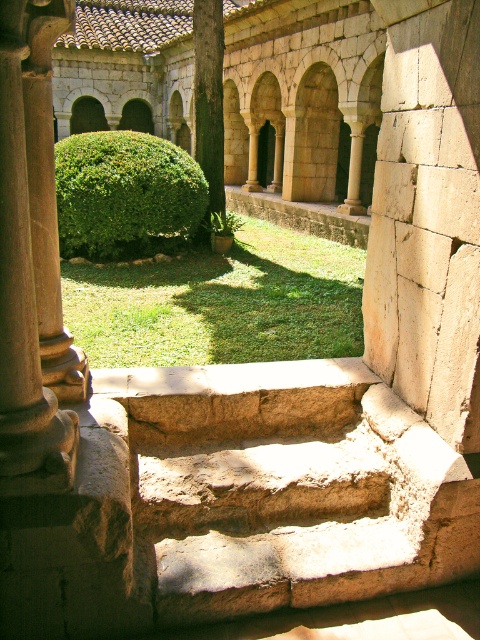
Consider the image. Can you confirm if green leafy hedge at center is positioned to the left of green textured pillar at center?

Correct, you'll find green leafy hedge at center to the left of green textured pillar at center.

How much distance is there between green leafy hedge at center and green textured pillar at center?

The distance of green leafy hedge at center from green textured pillar at center is 1.16 meters.

Between point (203, 179) and point (195, 20), which one is positioned behind?

Point (195, 20)

At what (x,y) coordinates should I click in order to perform the action: click on green leafy hedge at center. Please return your answer as a coordinate pair (x, y). Image resolution: width=480 pixels, height=640 pixels. Looking at the image, I should click on (126, 195).

Can you confirm if smooth stone column at left is positioned above green leafy hedge at center?

Incorrect, smooth stone column at left is not positioned above green leafy hedge at center.

Which is more to the left, smooth stone column at left or green leafy hedge at center?

Positioned to the left is green leafy hedge at center.

This screenshot has width=480, height=640. Identify the location of smooth stone column at left. (32, 260).

Who is shorter, green grass at center or smooth stone column at left?

Standing shorter between the two is green grass at center.

The width and height of the screenshot is (480, 640). Identify the location of green grass at center. (222, 304).

At what (x,y) coordinates should I click in order to perform the action: click on green grass at center. Please return your answer as a coordinate pair (x, y). The width and height of the screenshot is (480, 640). Looking at the image, I should click on (222, 304).